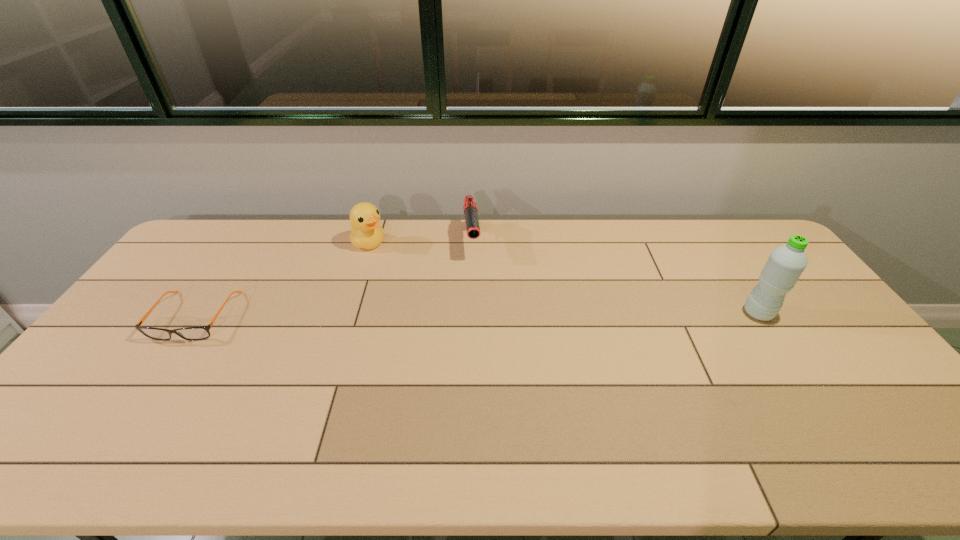
Locate an element on the screen. vacant space on the desktop that is between the leftmost object and the water bottle and is positioned on the face of the duck is located at coordinates (467, 315).

At what (x,y) coordinates should I click in order to perform the action: click on free spot on the desktop that is between the leftmost object and the water bottle and is positioned at the aiming end of the second object from right to left. Please return your answer as a coordinate pair (x, y). This screenshot has height=540, width=960. Looking at the image, I should click on (482, 315).